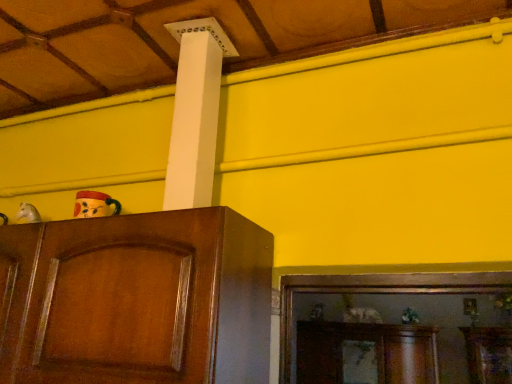
Question: From the image's perspective, would you say white matte horse head at left, the first toy viewed from the left, is positioned over matte wooden mask at left, arranged as the 3th toy when ordered from the bottom?

Choices:
 (A) yes
 (B) no

Answer: (B)

Question: Considering the relative positions of white matte horse head at left, the 2th toy positioned from the top, and matte wooden mask at left, arranged as the first toy when viewed from the front, in the image provided, is white matte horse head at left, the 2th toy positioned from the top, to the right of matte wooden mask at left, arranged as the first toy when viewed from the front, from the viewer's perspective?

Choices:
 (A) no
 (B) yes

Answer: (A)

Question: From a real-world perspective, is white matte horse head at left, positioned as the second toy in back-to-front order, beneath matte wooden mask at left, the 1th toy in the top-to-bottom sequence?

Choices:
 (A) yes
 (B) no

Answer: (B)

Question: Would you say white matte horse head at left, the first toy viewed from the left, contains matte wooden mask at left, the 1th toy in the top-to-bottom sequence?

Choices:
 (A) yes
 (B) no

Answer: (B)

Question: Does white matte horse head at left, positioned as the 2th toy in bottom-to-top order, have a smaller size compared to matte wooden mask at left, arranged as the 3th toy when ordered from the bottom?

Choices:
 (A) no
 (B) yes

Answer: (B)

Question: From the image's perspective, is white matte horse head at left, positioned as the second toy in back-to-front order, located above or below green matte plant at lower right, the 1th toy positioned from the back?

Choices:
 (A) above
 (B) below

Answer: (A)

Question: Considering the positions of white matte horse head at left, the second toy when ordered from front to back, and green matte plant at lower right, the 3th toy in the left-to-right sequence, in the image, is white matte horse head at left, the second toy when ordered from front to back, bigger or smaller than green matte plant at lower right, the 3th toy in the left-to-right sequence,?

Choices:
 (A) big
 (B) small

Answer: (B)

Question: From a real-world perspective, is white matte horse head at left, the second toy when ordered from front to back, physically located above or below green matte plant at lower right, the first toy in the bottom-to-top sequence?

Choices:
 (A) above
 (B) below

Answer: (A)

Question: Which is correct: white matte horse head at left, marked as the 3th toy in a right-to-left arrangement, is inside green matte plant at lower right, the first toy in the bottom-to-top sequence, or outside of it?

Choices:
 (A) inside
 (B) outside

Answer: (B)

Question: In terms of height, does white matte horse head at left, positioned as the 2th toy in bottom-to-top order, look taller or shorter compared to matte wooden mask at left, the 3th toy viewed from the back?

Choices:
 (A) short
 (B) tall

Answer: (A)

Question: In the image, is white matte horse head at left, marked as the 3th toy in a right-to-left arrangement, positioned in front of or behind matte wooden mask at left, which ranks as the second toy in left-to-right order?

Choices:
 (A) front
 (B) behind

Answer: (B)

Question: From the image's perspective, is white matte horse head at left, the 2th toy positioned from the top, above or below matte wooden mask at left, arranged as the first toy when viewed from the front?

Choices:
 (A) above
 (B) below

Answer: (B)

Question: In terms of size, does white matte horse head at left, positioned as the second toy in back-to-front order, appear bigger or smaller than matte wooden mask at left, arranged as the 3th toy when ordered from the bottom?

Choices:
 (A) small
 (B) big

Answer: (A)

Question: Is point (25, 221) positioned closer to the camera than point (53, 337)?

Choices:
 (A) closer
 (B) farther

Answer: (B)

Question: Considering the positions of white matte horse head at left, positioned as the 2th toy in bottom-to-top order, and shiny brown cabinet at left in the image, is white matte horse head at left, positioned as the 2th toy in bottom-to-top order, bigger or smaller than shiny brown cabinet at left?

Choices:
 (A) small
 (B) big

Answer: (A)